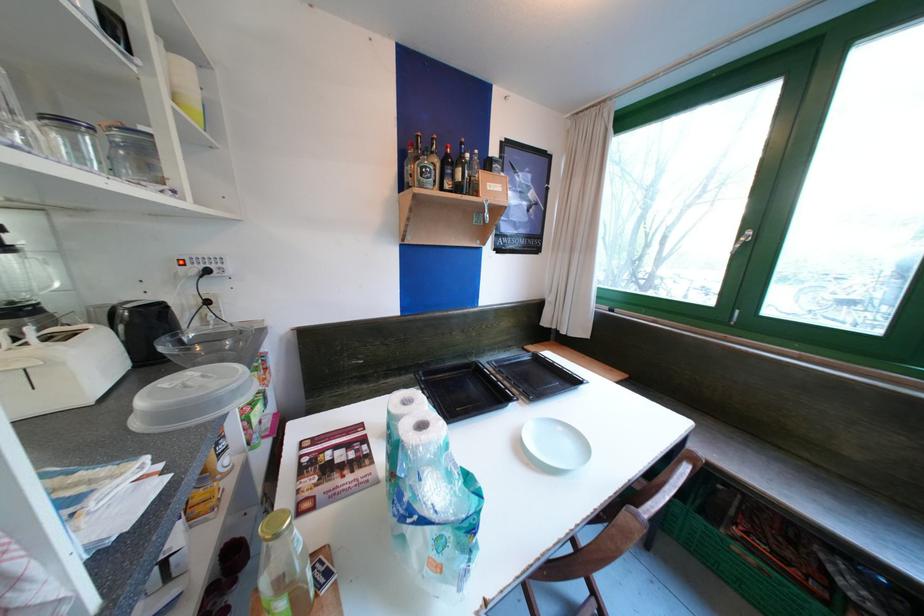
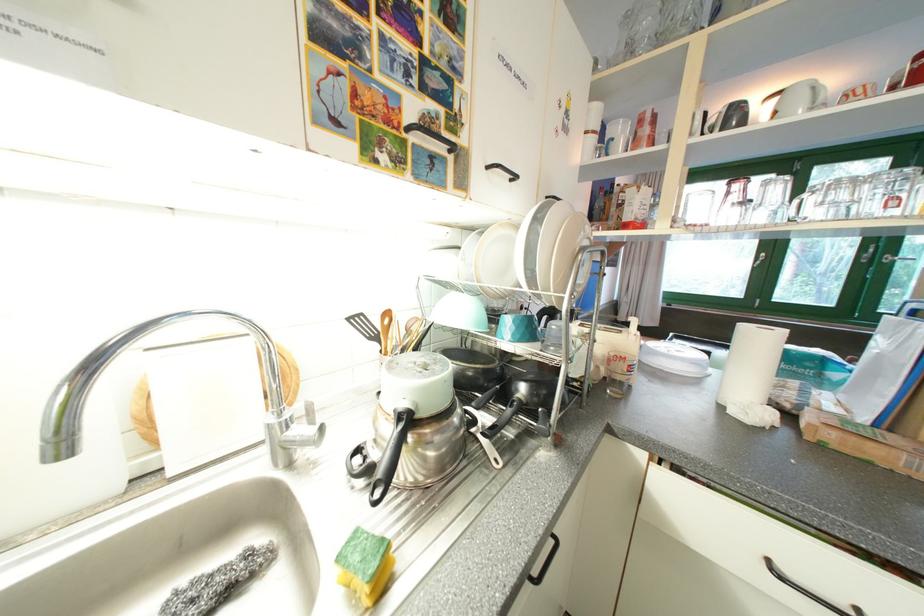
Question: I am providing you with two images of the same scene from different viewpoints. Which of the following objects are not visible in image2?

Choices:
 (A) yellow sponge
 (B) pink folded blanket
 (C) black kettle handle
 (D) light blue bowl

Answer: (C)